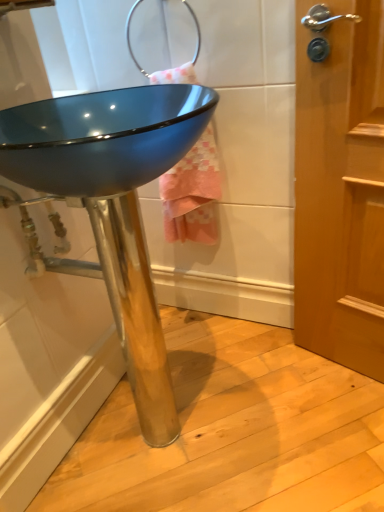
Question: From a real-world perspective, is pink textured towel at upper center over glossy blue basin at center?

Choices:
 (A) yes
 (B) no

Answer: (A)

Question: Is pink textured towel at upper center further to the viewer compared to glossy blue basin at center?

Choices:
 (A) yes
 (B) no

Answer: (A)

Question: From a real-world perspective, is pink textured towel at upper center beneath glossy blue basin at center?

Choices:
 (A) yes
 (B) no

Answer: (B)

Question: Does pink textured towel at upper center turn towards glossy blue basin at center?

Choices:
 (A) no
 (B) yes

Answer: (B)

Question: From the image's perspective, is pink textured towel at upper center over glossy blue basin at center?

Choices:
 (A) yes
 (B) no

Answer: (A)

Question: Is pink textured towel at upper center closer to camera compared to glossy blue basin at center?

Choices:
 (A) yes
 (B) no

Answer: (B)

Question: From the image's perspective, is glossy blue basin at center beneath pink textured towel at upper center?

Choices:
 (A) no
 (B) yes

Answer: (B)

Question: Is glossy blue basin at center aimed at pink textured towel at upper center?

Choices:
 (A) no
 (B) yes

Answer: (A)

Question: Considering the relative sizes of glossy blue basin at center and pink textured towel at upper center in the image provided, is glossy blue basin at center shorter than pink textured towel at upper center?

Choices:
 (A) no
 (B) yes

Answer: (A)

Question: From a real-world perspective, is glossy blue basin at center positioned over pink textured towel at upper center based on gravity?

Choices:
 (A) yes
 (B) no

Answer: (B)

Question: Is glossy blue basin at center at the left side of pink textured towel at upper center?

Choices:
 (A) no
 (B) yes

Answer: (B)

Question: Would you say glossy blue basin at center is a long distance from pink textured towel at upper center?

Choices:
 (A) no
 (B) yes

Answer: (A)

Question: Considering the positions of glossy blue basin at center and pink textured towel at upper center in the image, is glossy blue basin at center wider or thinner than pink textured towel at upper center?

Choices:
 (A) thin
 (B) wide

Answer: (B)